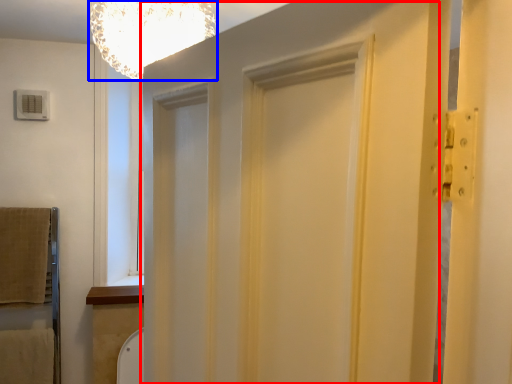
Question: Which object is further to the camera taking this photo, barn door (highlighted by a red box) or light fixture (highlighted by a blue box)?

Choices:
 (A) barn door
 (B) light fixture

Answer: (B)